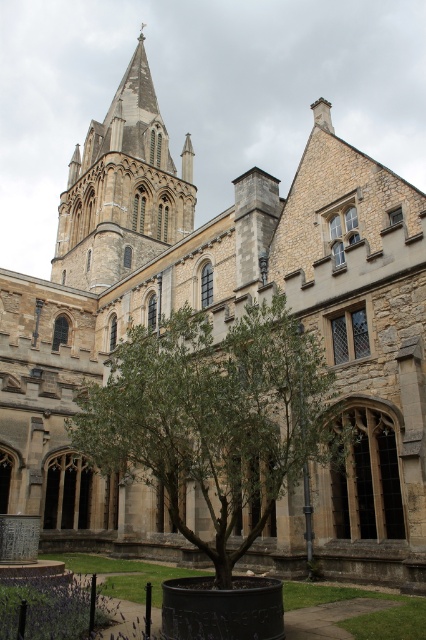
You are a visitor standing in front of the historic stone building. You want to take a photo of the smooth stone tower at upper left without the green leafy tree at center blocking the view. Is this possible from your current position?

The green leafy tree at center is in front of the smooth stone tower at upper left, so it will block the view. Move to a position where the tree is not between you and the tower to take an unobstructed photo.

You are standing in front of the historic stone building and want to take a photo of the smooth stone tower at upper left. However, there is a green leafy tree at center blocking your view. Based on their positions, can you determine if the tree is positioned to the right or left of the tower?

The green leafy tree at center is positioned to the right of the smooth stone tower at upper left, so the tree is blocking the view from the right side of the tower.